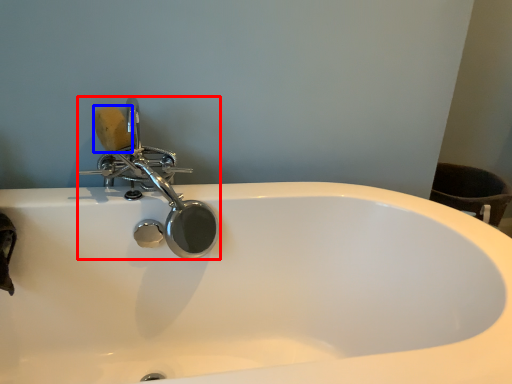
Question: Which object appears closest to the camera in this image, tap (highlighted by a red box) or soap (highlighted by a blue box)?

Choices:
 (A) tap
 (B) soap

Answer: (A)